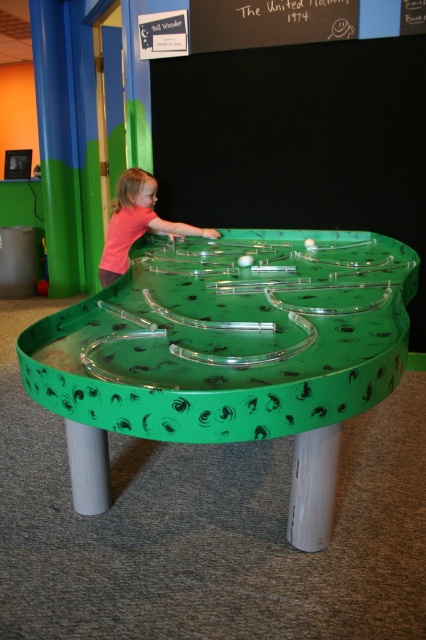
Does green glossy table at center have a greater width compared to pink matte shirt at upper left?

Yes, green glossy table at center is wider than pink matte shirt at upper left.

Does point (281, 374) come behind point (131, 180)?

No, it is in front of (131, 180).

Identify the location of green glossy table at center. (229, 355).